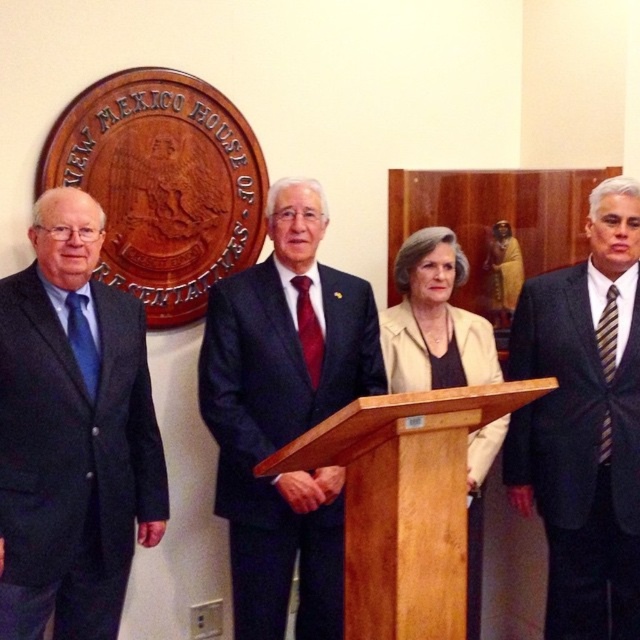
You are attending a formal event in the New Mexico House of Representatives building and notice two people wearing different outfits at the center. The outfits are labeled as dark blue suit at center and beige fabric jacket at center. From your perspective, which outfit is positioned lower in the image?

The dark blue suit at center is located below the beige fabric jacket at center, so the dark blue suit at center is positioned lower in the image.

You are attending a formal event in a government building and notice two attendees dressed in dark gray suit at right and beige fabric jacket at center. From your perspective, which one is positioned to the right of the other?

The dark gray suit at right is positioned to the right of the beige fabric jacket at center.

From the picture: You are standing in the New Mexico House of Representatives chamber and notice a point marked at coordinates [72,433]. Which object from the scene does this point correspond to?

The point at coordinates [72,433] corresponds to the dark blue suit at left.